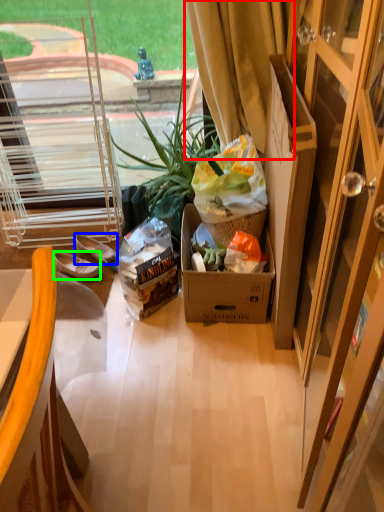
Question: Which object is the closest to the curtain (highlighted by a red box)? Choose among these: footwear (highlighted by a blue box) or slippers (highlighted by a green box).

Choices:
 (A) footwear
 (B) slippers

Answer: (A)